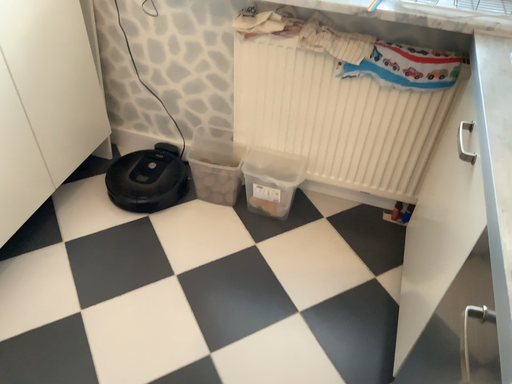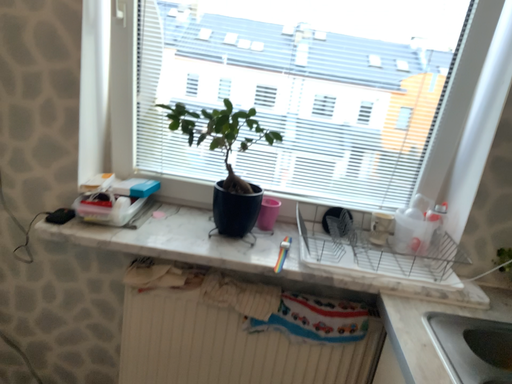
Question: Which way did the camera rotate in the video?

Choices:
 (A) rotated left
 (B) rotated right

Answer: (B)